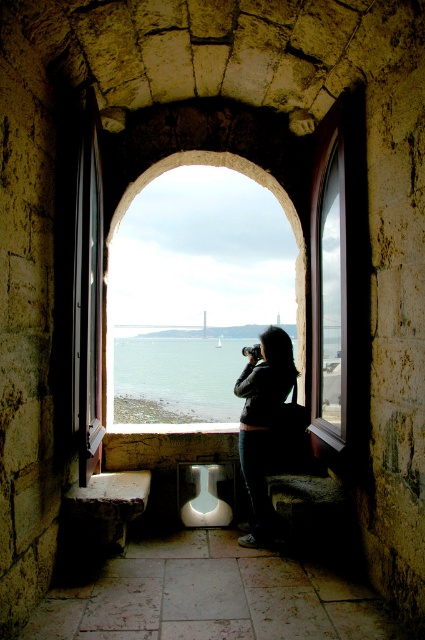
Question: Considering the relative positions of transparent glass window at center and dark gray sweater at center in the image provided, where is transparent glass window at center located with respect to dark gray sweater at center?

Choices:
 (A) below
 (B) above

Answer: (B)

Question: In this image, where is transparent glass window at center located relative to dark gray sweater at center?

Choices:
 (A) above
 (B) below

Answer: (A)

Question: Which object is farther from the camera taking this photo?

Choices:
 (A) dark gray sweater at center
 (B) transparent glass window at center

Answer: (A)

Question: Can you confirm if transparent glass window at center is positioned to the left of dark gray sweater at center?

Choices:
 (A) yes
 (B) no

Answer: (B)